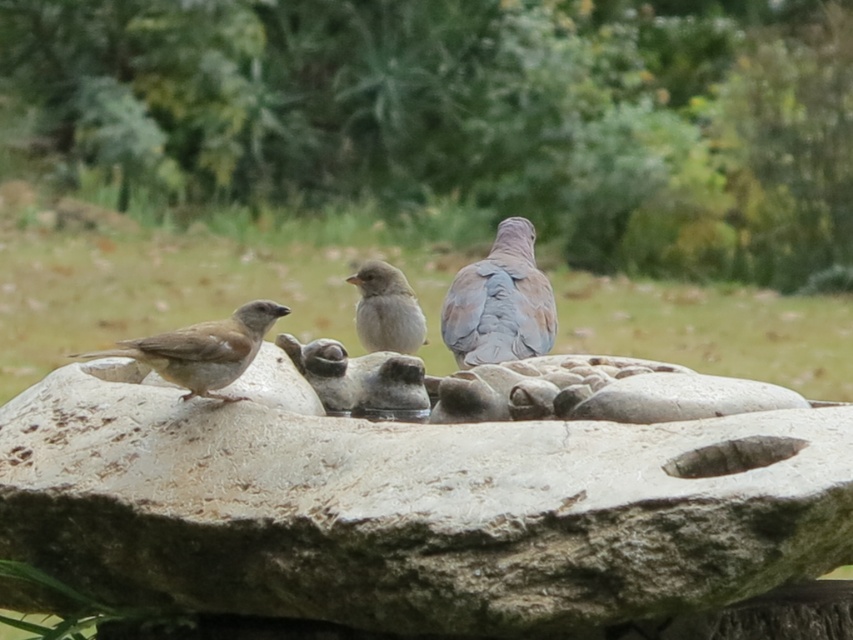
You are a bird watching enthusiast standing near the rough stone bird bath at center and the brown matte sparrow at left. Which object is positioned lower in the scene?

The rough stone bird bath at center is located below the brown matte sparrow at left, so the rough stone bird bath at center is positioned lower in the scene.

You are standing in a garden and see the rough stone bird bath at center and the gray feathered dove at center. Which object is positioned to the left of the other?

The rough stone bird bath at center is to the left of the gray feathered dove at center.

You are a birdwatcher observing the rough stone bird bath at center and the gray matte sparrow at center. Which object is bigger in size?

The rough stone bird bath at center is larger in size compared to the gray matte sparrow at center.